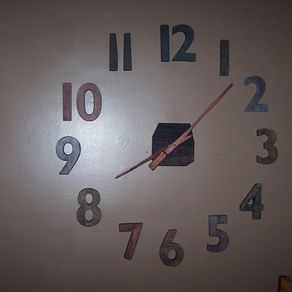
Find the location of a particular element. This screenshot has width=292, height=292. minute hand of clock is located at coordinates (210, 107).